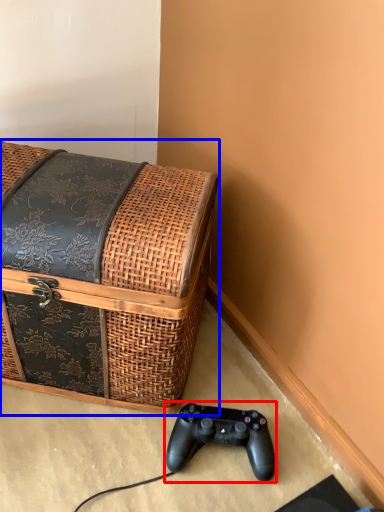
Question: Among these objects, which one is farthest to the camera, game controller (highlighted by a red box) or furniture (highlighted by a blue box)?

Choices:
 (A) game controller
 (B) furniture

Answer: (A)